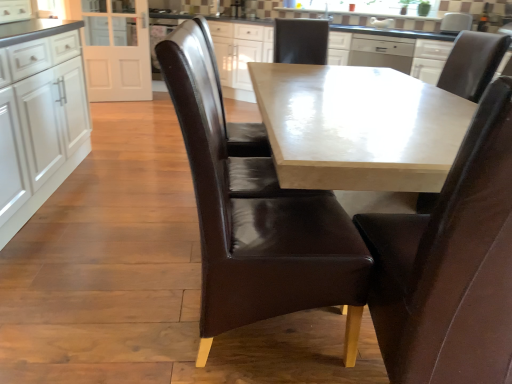
Question: Considering the positions of brown leather chair at center, positioned as the 2th chair in right-to-left order, and brown leather chair at center, placed as the 1th chair when sorted from left to right, in the image, is brown leather chair at center, positioned as the 2th chair in right-to-left order, taller or shorter than brown leather chair at center, placed as the 1th chair when sorted from left to right,?

Choices:
 (A) tall
 (B) short

Answer: (B)

Question: Is point (464, 380) positioned closer to the camera than point (229, 135)?

Choices:
 (A) farther
 (B) closer

Answer: (B)

Question: Based on their relative distances, which object is farther from the brown leather chair at center, positioned as the 2th chair in right-to-left order?

Choices:
 (A) white glossy sink at upper center
 (B) white glossy microwave at upper center
 (C) white glossy cabinets at left, which is the 1th cabinetry in front-to-back order
 (D) white glossy cabinet at upper center, the second cabinetry positioned from the front
 (E) satin silver dishwasher at upper center

Answer: (A)

Question: Which object is positioned farthest from the white glossy microwave at upper center?

Choices:
 (A) white glossy cabinet at upper center, the first cabinetry in the right-to-left sequence
 (B) white glossy sink at upper center
 (C) brown leather chair at center, positioned as the 2th chair in right-to-left order
 (D) brown leather chair at center, marked as the 4th chair in a right-to-left arrangement
 (E) satin silver dishwasher at upper center

Answer: (C)